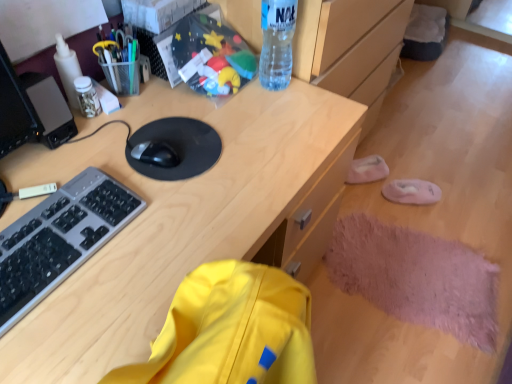
Question: Could you tell me if wooden desk at center is turned towards black matte mouse at center?

Choices:
 (A) no
 (B) yes

Answer: (A)

Question: Considering the relative sizes of wooden desk at center and black matte mouse at center in the image provided, is wooden desk at center thinner than black matte mouse at center?

Choices:
 (A) yes
 (B) no

Answer: (B)

Question: Considering the relative sizes of wooden desk at center and black matte mouse at center in the image provided, is wooden desk at center wider than black matte mouse at center?

Choices:
 (A) yes
 (B) no

Answer: (A)

Question: Is wooden desk at center in front of black matte mouse at center?

Choices:
 (A) no
 (B) yes

Answer: (B)

Question: Is black matte mouse at center at the back of wooden desk at center?

Choices:
 (A) yes
 (B) no

Answer: (B)

Question: Can you confirm if wooden desk at center is taller than black matte mouse at center?

Choices:
 (A) no
 (B) yes

Answer: (B)

Question: Is black matte mouse at center located outside metallic pen holder at upper left, positioned as the first stationery in right-to-left order?

Choices:
 (A) no
 (B) yes

Answer: (B)

Question: From a real-world perspective, is black matte mouse at center on top of metallic pen holder at upper left, the second stationery viewed from the left?

Choices:
 (A) no
 (B) yes

Answer: (A)

Question: Can you confirm if black matte mouse at center is shorter than metallic pen holder at upper left, the second stationery viewed from the left?

Choices:
 (A) yes
 (B) no

Answer: (A)

Question: Is black matte mouse at center behind metallic pen holder at upper left, positioned as the first stationery in right-to-left order?

Choices:
 (A) no
 (B) yes

Answer: (A)

Question: Can you confirm if black matte mouse at center is wider than metallic pen holder at upper left, the second stationery viewed from the left?

Choices:
 (A) no
 (B) yes

Answer: (A)

Question: Is black matte mouse at center with metallic pen holder at upper left, the second stationery viewed from the left?

Choices:
 (A) yes
 (B) no

Answer: (B)

Question: From a real-world perspective, is white plastic bottle at upper left, the 2th bottle from the right, positioned over black matte mousepad at center based on gravity?

Choices:
 (A) no
 (B) yes

Answer: (B)